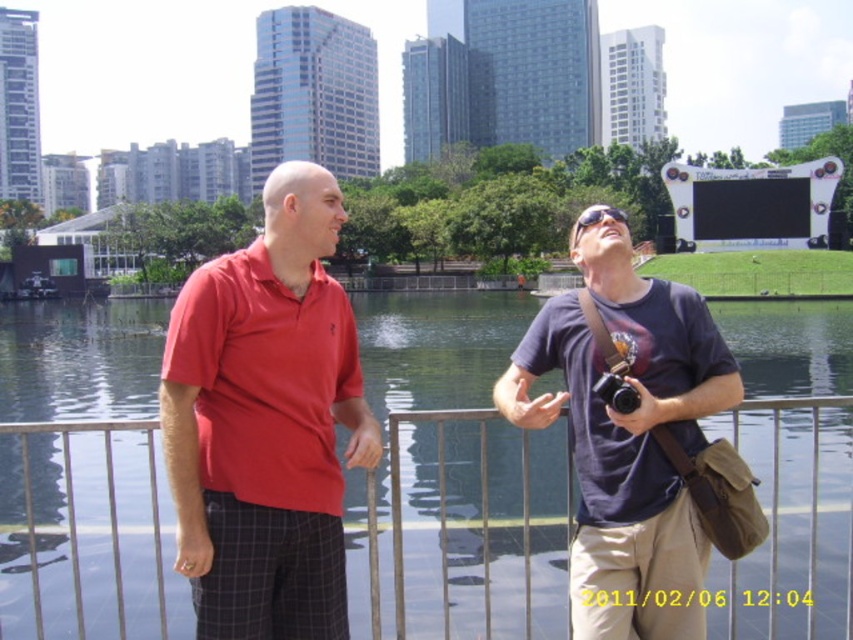
Who is positioned more to the left, metallic silver fence at lower center or matte red polo shirt at left?

matte red polo shirt at left

Is metallic silver fence at lower center to the right of matte red polo shirt at left from the viewer's perspective?

Correct, you'll find metallic silver fence at lower center to the right of matte red polo shirt at left.

The image size is (853, 640). Find the location of `metallic silver fence at lower center`. metallic silver fence at lower center is located at coordinates (465, 532).

Find the location of `metallic silver fence at lower center`. metallic silver fence at lower center is located at coordinates (465, 532).

Does point (520, 500) lie in front of point (618, 472)?

No, (520, 500) is behind (618, 472).

Find the location of a particular element. The image size is (853, 640). metallic silver fence at lower center is located at coordinates (465, 532).

Does matte red polo shirt at left lie in front of dark blue t-shirt at center?

Yes, it is.

I want to click on matte red polo shirt at left, so click(265, 420).